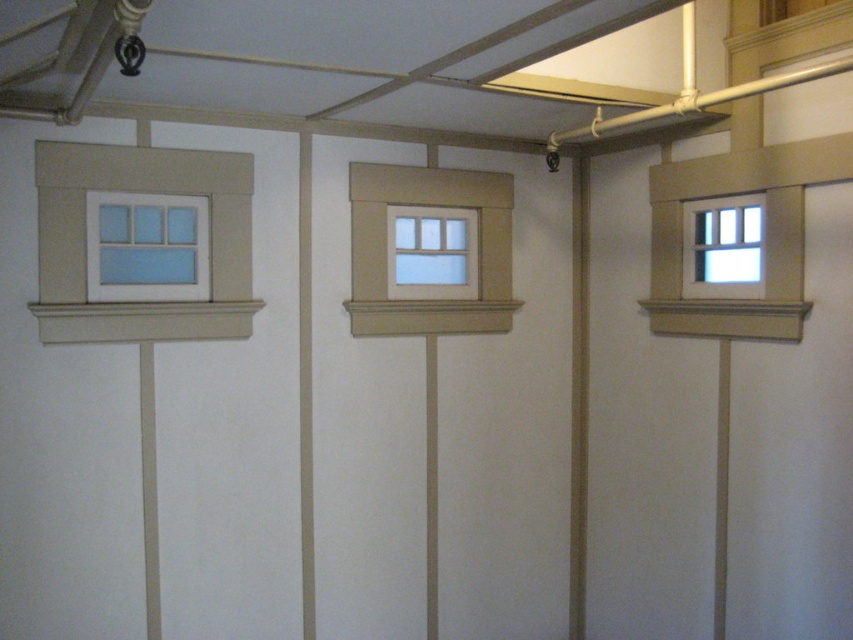
Question: Which object is farther from the camera taking this photo?

Choices:
 (A) matte beige window frame at left
 (B) white painted wood window at upper left
 (C) matte white wood window at center

Answer: (C)

Question: Is matte white wood window at center above white painted wood window at right?

Choices:
 (A) no
 (B) yes

Answer: (B)

Question: Considering the relative positions of white painted wood window at center and white painted wood window at right in the image provided, where is white painted wood window at center located with respect to white painted wood window at right?

Choices:
 (A) left
 (B) right

Answer: (A)

Question: Which object is the farthest from the white painted wood window at right?

Choices:
 (A) matte white wood window at center
 (B) white painted wood window at center
 (C) white painted wood window at upper left

Answer: (C)

Question: Can you confirm if matte beige window frame at left is positioned below white painted wood window at right?

Choices:
 (A) yes
 (B) no

Answer: (A)

Question: Which of the following is the farthest from the observer?

Choices:
 (A) white painted wood window at upper left
 (B) matte beige window frame at left
 (C) white painted wood window at center
 (D) white painted wood window at right

Answer: (C)